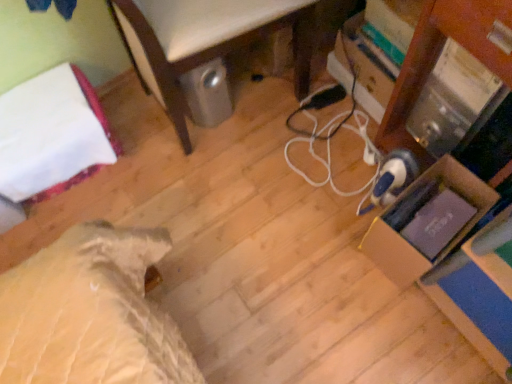
Find the location of a particular element. empty space that is in between metallic silver trash can at lower center and white cord at center is located at coordinates 262,179.